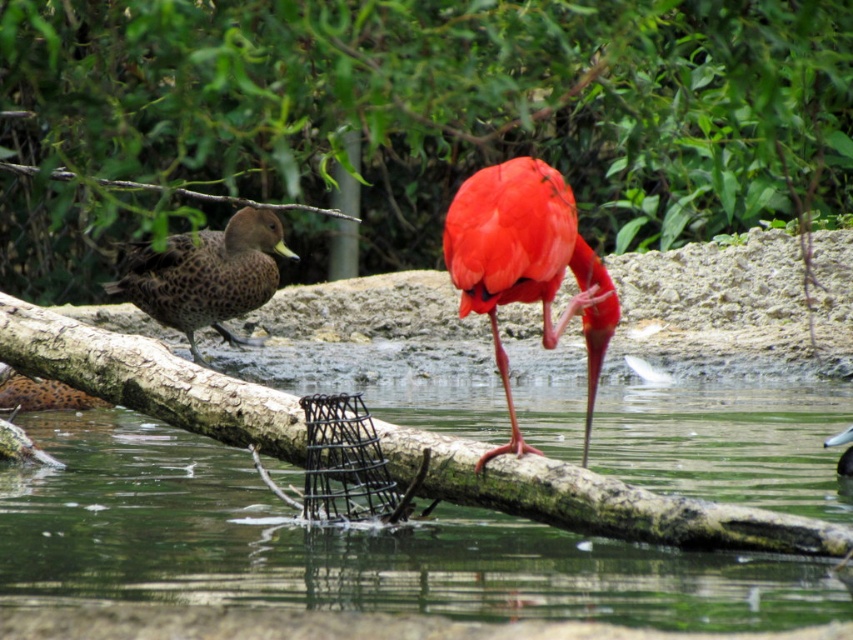
Question: Is bright red feathered bird at center to the left of brown speckled duck at upper left from the viewer's perspective?

Choices:
 (A) yes
 (B) no

Answer: (A)

Question: Based on their relative distances, which object is nearer to the brown speckled duck at upper left?

Choices:
 (A) spotted brown duck at left
 (B) brown speckled duck at left
 (C) bright red feathered bird at center
 (D) green leafy tree at upper center

Answer: (C)

Question: Based on their relative distances, which object is nearer to the spotted brown duck at left?

Choices:
 (A) brown speckled duck at left
 (B) bright red feathered bird at center
 (C) brown speckled duck at upper left
 (D) green leafy tree at upper center

Answer: (A)

Question: Which object appears closest to the camera in this image?

Choices:
 (A) brown speckled duck at left
 (B) green leafy tree at upper center
 (C) brown speckled duck at upper left
 (D) spotted brown duck at left

Answer: (B)

Question: Is bright red feathered bird at center to the right of brown speckled duck at left from the viewer's perspective?

Choices:
 (A) no
 (B) yes

Answer: (B)

Question: Is green leafy tree at upper center below bright red feathered bird at center?

Choices:
 (A) no
 (B) yes

Answer: (A)